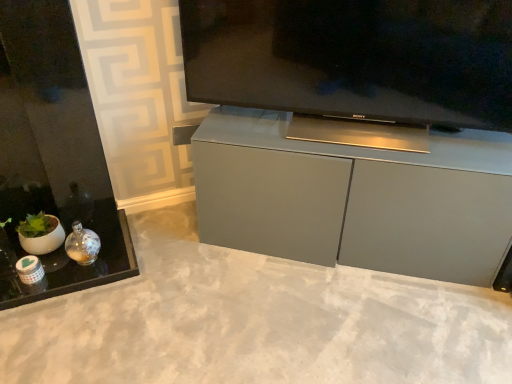
The height and width of the screenshot is (384, 512). What are the coordinates of `matte gray cabinet at center` in the screenshot? It's located at (355, 198).

This screenshot has width=512, height=384. Describe the element at coordinates (255, 322) in the screenshot. I see `matte gray concrete at center` at that location.

You are a GUI agent. You are given a task and a screenshot of the screen. Output one action in this format:
    pyautogui.click(x=<x>, y=<y>)
    Task: Click on the satin silver television at center
    
    Given the screenshot: What is the action you would take?
    pyautogui.click(x=354, y=58)

Is matte gray cabinet at center far away from satin silver television at center?

That's not correct — matte gray cabinet at center is a little close to satin silver television at center.

Is matte gray cabinet at center taller than satin silver television at center?

Indeed, matte gray cabinet at center has a greater height compared to satin silver television at center.

Could you tell me if matte gray cabinet at center is turned towards satin silver television at center?

No, matte gray cabinet at center is not aimed at satin silver television at center.

From the image's perspective, relative to satin silver television at center, is matte gray cabinet at center above or below?

matte gray cabinet at center is below satin silver television at center.

Between satin silver television at center and matte gray concrete at center, which one has smaller size?

matte gray concrete at center.

Could you tell me if satin silver television at center is turned towards matte gray concrete at center?

No, satin silver television at center is not aimed at matte gray concrete at center.

Which of these two, satin silver television at center or matte gray concrete at center, stands shorter?

matte gray concrete at center is shorter.

From a real-world perspective, between satin silver television at center and matte gray concrete at center, who is vertically lower?

matte gray concrete at center.

Is matte gray concrete at center looking in the opposite direction of matte gray cabinet at center?

No, matte gray cabinet at center is not at the back of matte gray concrete at center.

What's the angular difference between matte gray concrete at center and matte gray cabinet at center's facing directions?

There is a 125-degree angle between the facing directions of matte gray concrete at center and matte gray cabinet at center.

From the image's perspective, between matte gray concrete at center and matte gray cabinet at center, who is located below?

matte gray concrete at center.

Does matte gray concrete at center appear on the right side of matte gray cabinet at center?

No.

Which of these two, matte gray cabinet at center or matte gray concrete at center, stands shorter?

Standing shorter between the two is matte gray concrete at center.

Would you consider matte gray cabinet at center to be distant from matte gray concrete at center?

No, matte gray cabinet at center is in close proximity to matte gray concrete at center.

Between point (236, 135) and point (97, 380), which one is positioned in front?

The point (97, 380) is in front.

Based on the photo, can you confirm if matte gray concrete at center is bigger than satin silver television at center?

No, matte gray concrete at center is not bigger than satin silver television at center.

Is matte gray concrete at center spatially inside satin silver television at center, or outside of it?

matte gray concrete at center is located beyond the bounds of satin silver television at center.

Is point (73, 343) farther from viewer compared to point (470, 105)?

No.

Is matte gray concrete at center looking in the opposite direction of satin silver television at center?

No, satin silver television at center is not at the back of matte gray concrete at center.

Is satin silver television at center beside matte gray cabinet at center?

No, satin silver television at center is not beside matte gray cabinet at center.

Which is more to the left, satin silver television at center or matte gray cabinet at center?

Positioned to the left is satin silver television at center.

Is satin silver television at center not within matte gray cabinet at center?

Indeed, satin silver television at center is completely outside matte gray cabinet at center.

Is satin silver television at center oriented away from matte gray cabinet at center?

No, satin silver television at center's orientation is not away from matte gray cabinet at center.

Where is `cabinetry below the satin silver television at center (from a real-world perspective)`? This screenshot has height=384, width=512. cabinetry below the satin silver television at center (from a real-world perspective) is located at coordinates (355, 198).

Where is `television behind the matte gray concrete at center`? This screenshot has height=384, width=512. television behind the matte gray concrete at center is located at coordinates (354, 58).

Considering their positions, is satin silver television at center positioned closer to matte gray cabinet at center than matte gray concrete at center?

The object closer to matte gray cabinet at center is satin silver television at center.

Which object lies nearer to the anchor point matte gray cabinet at center, matte gray concrete at center or satin silver television at center?

Among the two, satin silver television at center is located nearer to matte gray cabinet at center.

From the image, which object appears to be farther from matte gray concrete at center, satin silver television at center or matte gray cabinet at center?

satin silver television at center lies further to matte gray concrete at center than the other object.

Based on their spatial positions, is matte gray cabinet at center or matte gray concrete at center closer to satin silver television at center?

matte gray cabinet at center lies closer to satin silver television at center than the other object.

From the image, which object appears to be farther from matte gray concrete at center, matte gray cabinet at center or satin silver television at center?

Based on the image, satin silver television at center appears to be further to matte gray concrete at center.

Considering their positions, is matte gray concrete at center positioned closer to satin silver television at center than matte gray cabinet at center?

Based on the image, matte gray cabinet at center appears to be nearer to satin silver television at center.

This screenshot has height=384, width=512. Identify the location of cabinetry that lies between satin silver television at center and matte gray concrete at center from top to bottom. (355, 198).